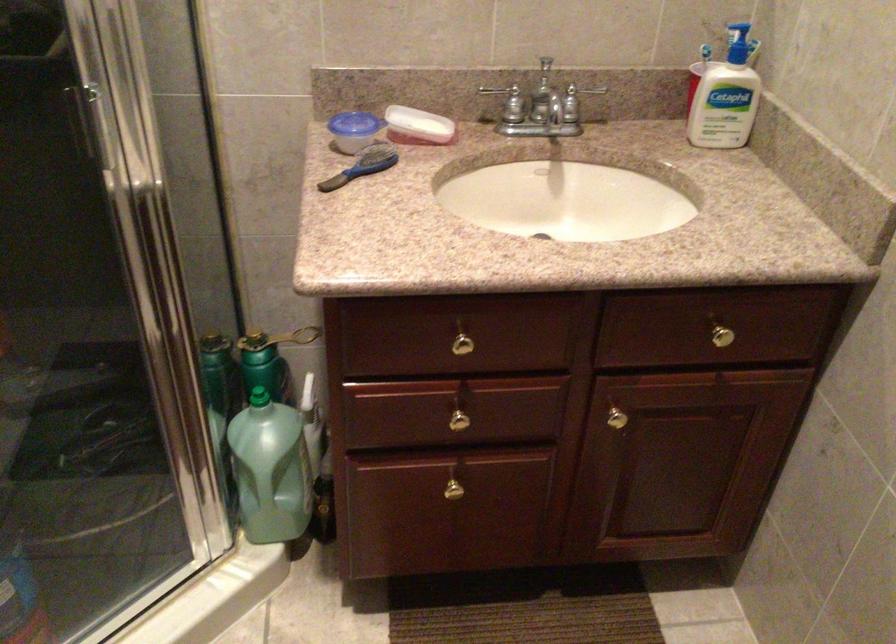
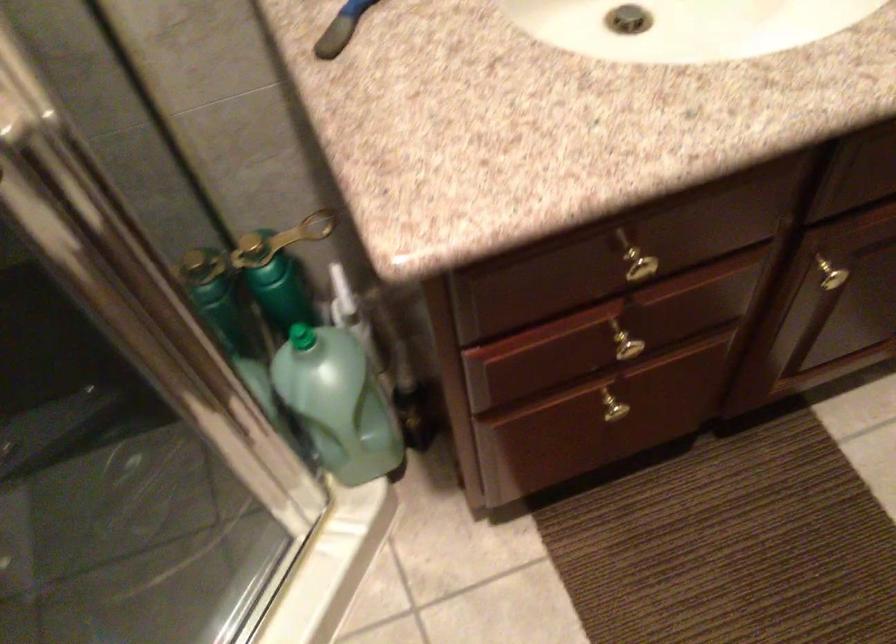
The images are taken continuously from a first-person perspective. In which direction are you moving?

The movement direction of the cameraman is left, forward.